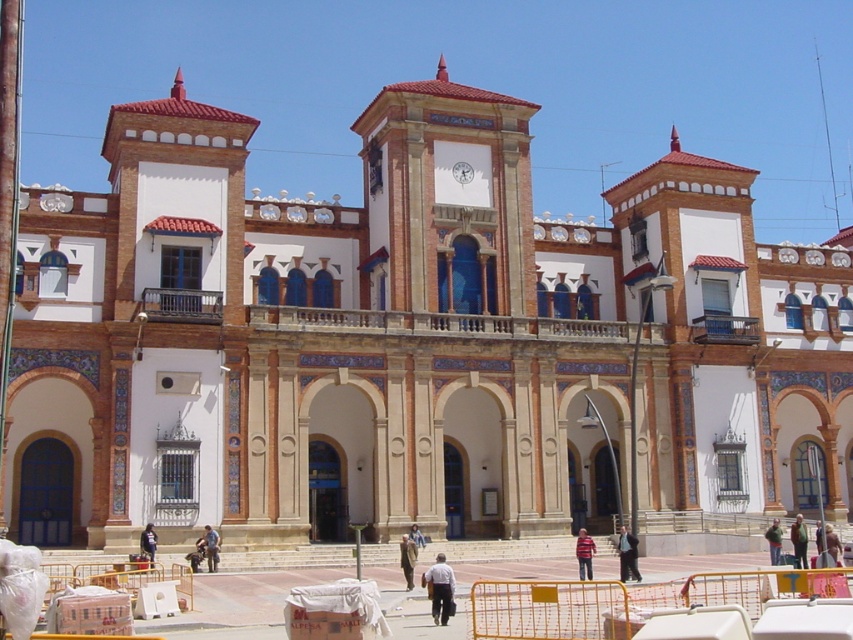
Question: Does white cotton shirt at center appear over striped shirt at center?

Choices:
 (A) yes
 (B) no

Answer: (A)

Question: Can you confirm if light brown leather jacket at center is smaller than green fabric jacket at center?

Choices:
 (A) yes
 (B) no

Answer: (A)

Question: Among these points, which one is nearest to the camera?

Choices:
 (A) (631, 570)
 (B) (149, 550)
 (C) (799, 561)

Answer: (A)

Question: Which object is closer to the camera taking this photo?

Choices:
 (A) green fabric jacket at center
 (B) dark suit at lower right
 (C) brown leather jacket at center
 (D) striped shirt at center

Answer: (C)

Question: Does light brown leather jacket at center appear under light blue denim jacket at center?

Choices:
 (A) yes
 (B) no

Answer: (A)

Question: Based on their relative distances, which object is farther from the striped shirt at center?

Choices:
 (A) light blue denim jacket at center
 (B) light brown leather jacket at center
 (C) green fabric jacket at center
 (D) brown leather jacket at center

Answer: (B)